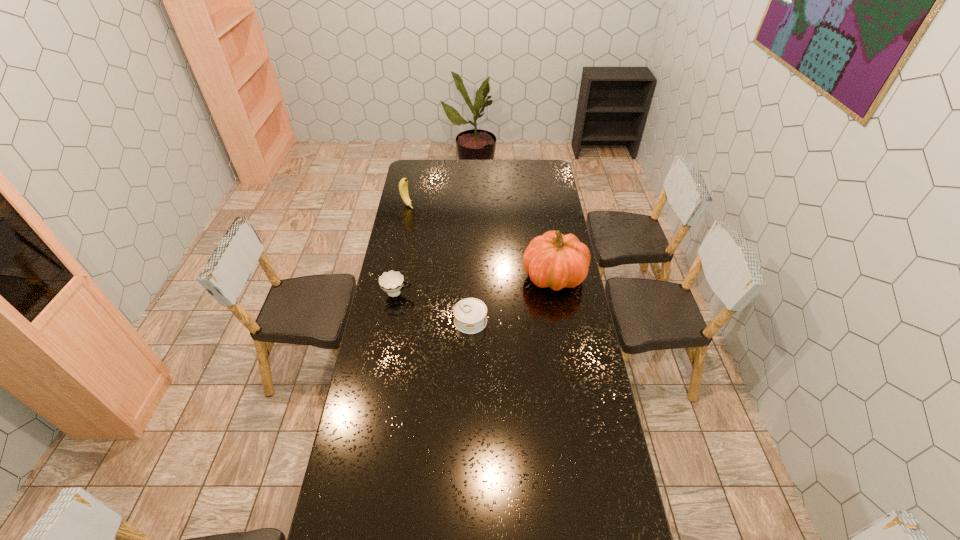
This screenshot has height=540, width=960. Identify the location of vacant region located from the stem of the second tallest object. (426, 221).

Image resolution: width=960 pixels, height=540 pixels. In order to click on free spot located from the stem of the second tallest object in this screenshot , I will do `click(446, 236)`.

Image resolution: width=960 pixels, height=540 pixels. Find the location of `vacant region located 0.350m on the side of the third tallest object with the handle`. vacant region located 0.350m on the side of the third tallest object with the handle is located at coordinates 491,298.

This screenshot has width=960, height=540. What are the coordinates of `free location located 0.160m on the side of the third tallest object with the handle` in the screenshot? It's located at (448, 296).

Locate an element on the screen. This screenshot has width=960, height=540. free space located 0.350m on the side of the third tallest object with the handle is located at coordinates (491, 298).

This screenshot has width=960, height=540. Find the location of `banana present at the left edge`. banana present at the left edge is located at coordinates (403, 184).

Where is `cup positioned at the left edge`? The image size is (960, 540). cup positioned at the left edge is located at coordinates (392, 282).

I want to click on object located in the right edge section of the desktop, so click(x=554, y=260).

Find the location of `vacant space at the far edge of the desktop`. vacant space at the far edge of the desktop is located at coordinates click(x=484, y=171).

The height and width of the screenshot is (540, 960). I want to click on free space at the left edge, so click(x=413, y=274).